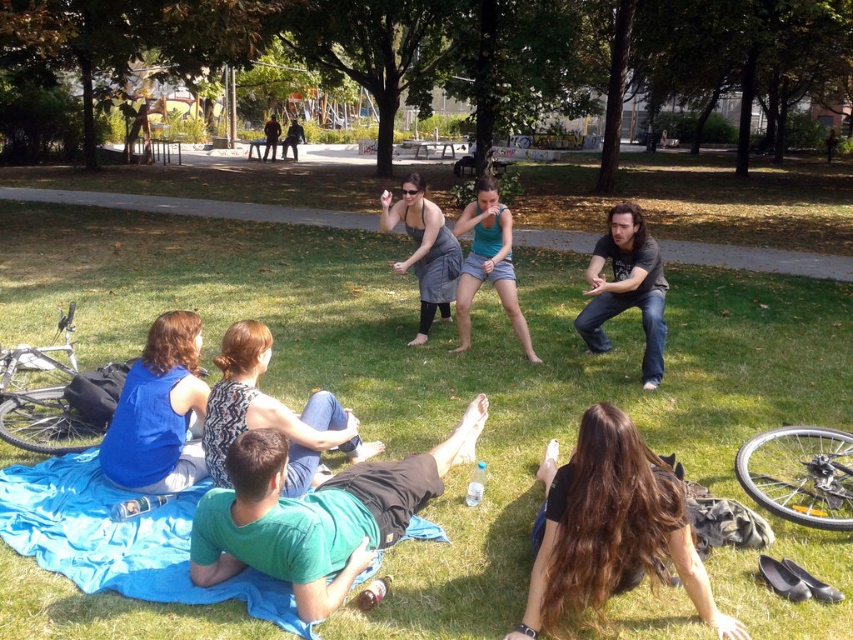
Question: Which object is farther from the camera taking this photo?

Choices:
 (A) green cotton shirt at lower center
 (B) dark gray shirt at center
 (C) dark gray dress at center
 (D) black leather shoes at lower right

Answer: (C)

Question: Is dark gray t-shirt at center thinner than teal fabric shorts at center?

Choices:
 (A) no
 (B) yes

Answer: (B)

Question: Does black leather shoes at lower right appear under dark gray dress at center?

Choices:
 (A) no
 (B) yes

Answer: (B)

Question: Is green cotton shirt at lower center bigger than black leather shoes at lower right?

Choices:
 (A) no
 (B) yes

Answer: (B)

Question: Which point is closer to the camera?

Choices:
 (A) black leather shoes at lower right
 (B) dark gray dress at center
 (C) dark gray shirt at center

Answer: (A)

Question: Among these points, which one is farthest from the camera?

Choices:
 (A) (730, 552)
 (B) (648, 266)
 (C) (422, 305)

Answer: (C)